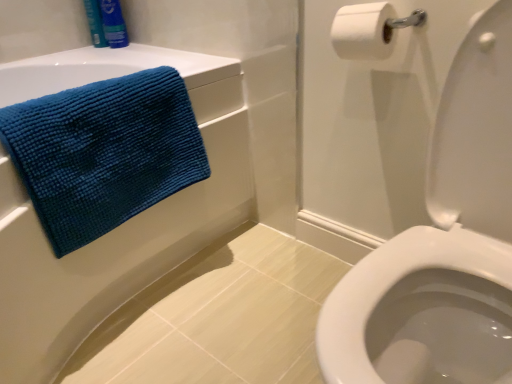
This screenshot has height=384, width=512. I want to click on blue textured towel at upper left, so 119,226.

What do you see at coordinates (119, 226) in the screenshot?
I see `blue textured towel at upper left` at bounding box center [119, 226].

Image resolution: width=512 pixels, height=384 pixels. What do you see at coordinates (113, 24) in the screenshot? I see `blue fabric shampoo at upper left, the 1th toiletry in the right-to-left sequence` at bounding box center [113, 24].

This screenshot has height=384, width=512. Describe the element at coordinates (362, 31) in the screenshot. I see `white matte toilet paper at upper right` at that location.

Locate an element on the screen. This screenshot has width=512, height=384. white glossy toilet seat at right is located at coordinates coord(442,243).

Describe the element at coordinates (95, 23) in the screenshot. I see `blue matte shampoo at upper left, the 2th toiletry from the right` at that location.

Find the location of `blue textured towel at upper left`. blue textured towel at upper left is located at coordinates (119, 226).

Would you say blue matte shampoo at upper left, the 2th toiletry from the right, is to the left or to the right of blue textured towel at upper left in the picture?

From the image, it's evident that blue matte shampoo at upper left, the 2th toiletry from the right, is to the left of blue textured towel at upper left.

Does blue matte shampoo at upper left, marked as the 1th toiletry in a left-to-right arrangement, have a greater height compared to blue textured towel at upper left?

No.

Looking at their sizes, would you say blue matte shampoo at upper left, marked as the 1th toiletry in a left-to-right arrangement, is wider or thinner than blue textured towel at upper left?

blue matte shampoo at upper left, marked as the 1th toiletry in a left-to-right arrangement, is thinner than blue textured towel at upper left.

From the picture: Which object is further away from the camera, teal textured towel at left or blue fabric shampoo at upper left, positioned as the second toiletry in left-to-right order?

blue fabric shampoo at upper left, positioned as the second toiletry in left-to-right order.

From the image's perspective, does teal textured towel at left appear lower than blue fabric shampoo at upper left, the 1th toiletry in the right-to-left sequence?

Yes.

In terms of height, does white glossy toilet seat at right look taller or shorter compared to teal textured towel at left?

→ white glossy toilet seat at right is taller than teal textured towel at left.

Based on the photo, in the image, is white glossy toilet seat at right on the left side or the right side of teal textured towel at left?

Clearly, white glossy toilet seat at right is on the right of teal textured towel at left in the image.

From the image's perspective, is white glossy toilet seat at right located above or below teal textured towel at left?

From the image's perspective, white glossy toilet seat at right appears below teal textured towel at left.

Between white glossy toilet seat at right and teal textured towel at left, which one has smaller width?

teal textured towel at left is thinner.

Considering the relative sizes of blue matte shampoo at upper left, the 2th toiletry from the right, and white matte toilet paper at upper right in the image provided, is blue matte shampoo at upper left, the 2th toiletry from the right, thinner than white matte toilet paper at upper right?

Correct, the width of blue matte shampoo at upper left, the 2th toiletry from the right, is less than that of white matte toilet paper at upper right.

From the image's perspective, would you say blue matte shampoo at upper left, marked as the 1th toiletry in a left-to-right arrangement, is shown under white matte toilet paper at upper right?

No.

Which is correct: blue matte shampoo at upper left, marked as the 1th toiletry in a left-to-right arrangement, is inside white matte toilet paper at upper right, or outside of it?

The correct answer is: outside.

How many degrees apart are the facing directions of blue matte shampoo at upper left, marked as the 1th toiletry in a left-to-right arrangement, and white matte toilet paper at upper right?

112 degrees.

From a real-world perspective, is white matte toilet paper at upper right above or below blue matte shampoo at upper left, the 2th toiletry from the right?

Clearly, from a real-world perspective, white matte toilet paper at upper right is below blue matte shampoo at upper left, the 2th toiletry from the right.

Considering the sizes of white matte toilet paper at upper right and blue matte shampoo at upper left, the 2th toiletry from the right, in the image, is white matte toilet paper at upper right wider or thinner than blue matte shampoo at upper left, the 2th toiletry from the right,?

Clearly, white matte toilet paper at upper right has more width compared to blue matte shampoo at upper left, the 2th toiletry from the right.

Which object is closer to the camera taking this photo, white matte toilet paper at upper right or blue matte shampoo at upper left, marked as the 1th toiletry in a left-to-right arrangement?

white matte toilet paper at upper right is more forward.

Can blue matte shampoo at upper left, marked as the 1th toiletry in a left-to-right arrangement, be found inside white matte toilet paper at upper right?

Actually, blue matte shampoo at upper left, marked as the 1th toiletry in a left-to-right arrangement, is outside white matte toilet paper at upper right.

Which is farther from the camera, (201, 120) or (183, 140)?

Point (201, 120)

Considering the relative sizes of blue textured towel at upper left and teal textured towel at left in the image provided, is blue textured towel at upper left bigger than teal textured towel at left?

Yes, blue textured towel at upper left is bigger than teal textured towel at left.

How different are the orientations of blue textured towel at upper left and teal textured towel at left in degrees?

The angle between the facing direction of blue textured towel at upper left and the facing direction of teal textured towel at left is 2.34 degrees.

Is blue textured towel at upper left placed right next to teal textured towel at left?

No, blue textured towel at upper left is not beside teal textured towel at left.

Which is less distant, [99,16] or [396,258]?

Point [99,16] is positioned farther from the camera compared to point [396,258].

Measure the distance between blue matte shampoo at upper left, the 2th toiletry from the right, and white glossy toilet seat at right.

They are 1.35 meters apart.

From the image's perspective, relative to white glossy toilet seat at right, is blue matte shampoo at upper left, the 2th toiletry from the right, above or below?

blue matte shampoo at upper left, the 2th toiletry from the right, is situated higher than white glossy toilet seat at right in the image.

In order to click on bath that is below the blue matte shampoo at upper left, the 2th toiletry from the right (from the image's perspective) in this screenshot , I will do `click(119, 226)`.

This screenshot has width=512, height=384. What are the coordinates of `towel in front of the blue fabric shampoo at upper left, positioned as the second toiletry in left-to-right order` in the screenshot? It's located at (104, 152).

Looking at the image, which one is located further to blue fabric shampoo at upper left, the 1th toiletry in the right-to-left sequence, white matte toilet paper at upper right or teal textured towel at left?

white matte toilet paper at upper right.

Estimate the real-world distances between objects in this image. Which object is closer to white glossy toilet seat at right, white matte toilet paper at upper right or blue fabric shampoo at upper left, positioned as the second toiletry in left-to-right order?

white matte toilet paper at upper right is closer to white glossy toilet seat at right.

From the picture: Which object lies further to the anchor point blue textured towel at upper left, white glossy toilet seat at right or blue fabric shampoo at upper left, positioned as the second toiletry in left-to-right order?

Based on the image, white glossy toilet seat at right appears to be further to blue textured towel at upper left.

When comparing their distances from white glossy toilet seat at right, does blue fabric shampoo at upper left, positioned as the second toiletry in left-to-right order, or white matte toilet paper at upper right seem further?

blue fabric shampoo at upper left, positioned as the second toiletry in left-to-right order, is positioned further to the anchor white glossy toilet seat at right.

Considering their positions, is white matte toilet paper at upper right positioned closer to teal textured towel at left than blue matte shampoo at upper left, the 2th toiletry from the right?

The object closer to teal textured towel at left is white matte toilet paper at upper right.

Based on their spatial positions, is blue textured towel at upper left or blue matte shampoo at upper left, marked as the 1th toiletry in a left-to-right arrangement, closer to white matte toilet paper at upper right?

Among the two, blue textured towel at upper left is located nearer to white matte toilet paper at upper right.

Considering their positions, is blue fabric shampoo at upper left, the 1th toiletry in the right-to-left sequence, positioned further to teal textured towel at left than blue matte shampoo at upper left, the 2th toiletry from the right?

Among the two, blue matte shampoo at upper left, the 2th toiletry from the right, is located further to teal textured towel at left.

Looking at the image, which one is located closer to white glossy toilet seat at right, blue matte shampoo at upper left, the 2th toiletry from the right, or white matte toilet paper at upper right?

Among the two, white matte toilet paper at upper right is located nearer to white glossy toilet seat at right.

This screenshot has width=512, height=384. Identify the location of towel between white glossy toilet seat at right and blue matte shampoo at upper left, marked as the 1th toiletry in a left-to-right arrangement, along the z-axis. (104, 152).

Locate an element on the screen. The width and height of the screenshot is (512, 384). toilet paper between white glossy toilet seat at right and blue fabric shampoo at upper left, positioned as the second toiletry in left-to-right order, in the front-back direction is located at coordinates (362, 31).

Where is `bath located between blue fabric shampoo at upper left, positioned as the second toiletry in left-to-right order, and white matte toilet paper at upper right in the left-right direction`? The image size is (512, 384). bath located between blue fabric shampoo at upper left, positioned as the second toiletry in left-to-right order, and white matte toilet paper at upper right in the left-right direction is located at coordinates (119, 226).

Where is `bath between white glossy toilet seat at right and blue fabric shampoo at upper left, positioned as the second toiletry in left-to-right order, from front to back`? bath between white glossy toilet seat at right and blue fabric shampoo at upper left, positioned as the second toiletry in left-to-right order, from front to back is located at coordinates (119, 226).